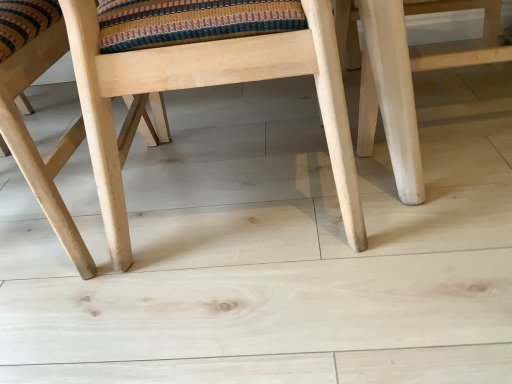
Question: Is natural wood chair at center, the 2th chair viewed from the right, to the left or to the right of natural wood chair at center, the second chair from the left, in the image?

Choices:
 (A) right
 (B) left

Answer: (B)

Question: Is natural wood chair at center, the 2th chair viewed from the right, inside or outside of natural wood chair at center, which is the 1th chair from right to left?

Choices:
 (A) inside
 (B) outside

Answer: (B)

Question: Is natural wood chair at center, the 2th chair viewed from the right, wider or thinner than natural wood chair at center, the second chair from the left?

Choices:
 (A) wide
 (B) thin

Answer: (A)

Question: Is natural wood chair at center, which is the 1th chair from right to left, in front of or behind natural wood chair at center, which ranks as the 1th chair in left-to-right order, in the image?

Choices:
 (A) behind
 (B) front

Answer: (B)

Question: In terms of height, does natural wood chair at center, the second chair from the left, look taller or shorter compared to natural wood chair at center, which ranks as the 1th chair in left-to-right order?

Choices:
 (A) tall
 (B) short

Answer: (A)

Question: Is natural wood chair at center, the second chair from the left, inside the boundaries of natural wood chair at center, which ranks as the 1th chair in left-to-right order, or outside?

Choices:
 (A) outside
 (B) inside

Answer: (A)

Question: In terms of width, does natural wood chair at center, the second chair from the left, look wider or thinner when compared to natural wood chair at center, which ranks as the 1th chair in left-to-right order?

Choices:
 (A) wide
 (B) thin

Answer: (B)